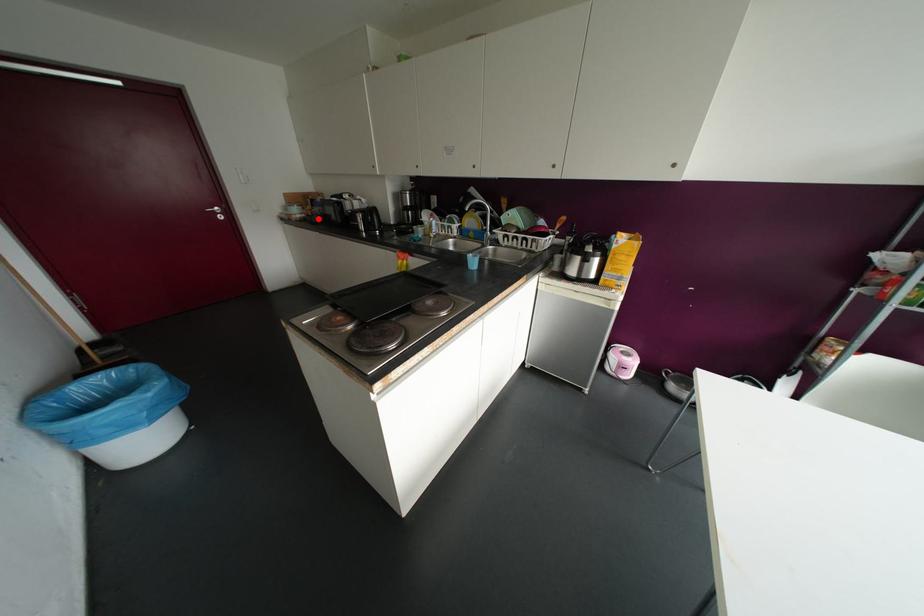
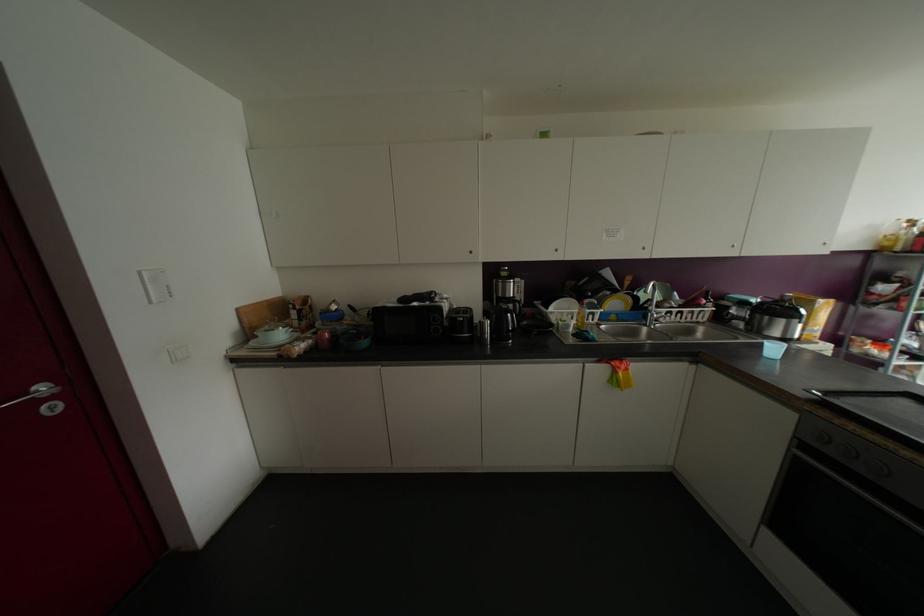
In the second image, find the point that corresponds to the highlighted location in the first image.

(363, 342)